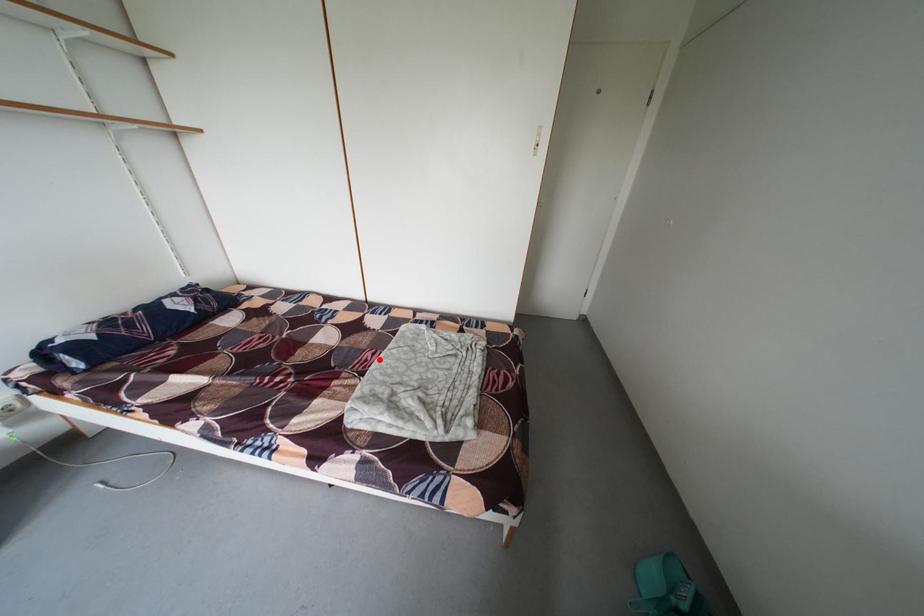
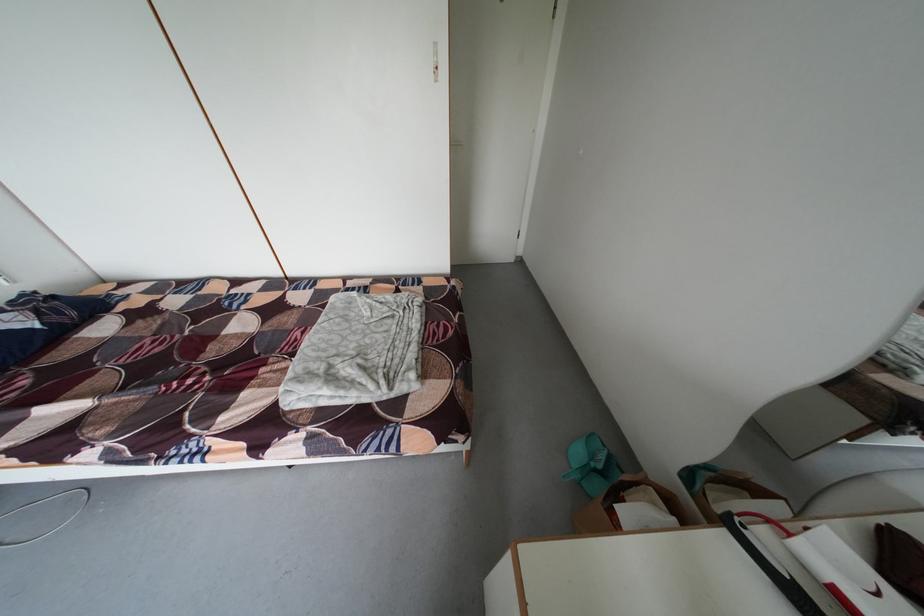
The point at the highlighted location is marked in the first image. Where is the corresponding point in the second image?

(309, 339)